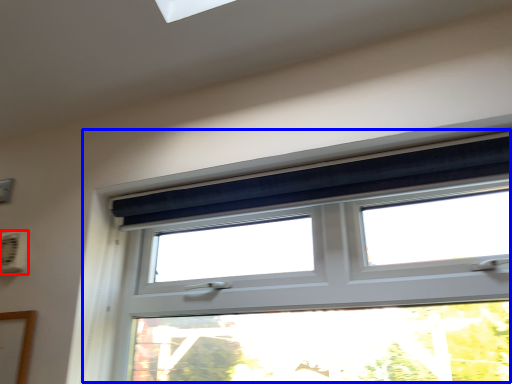
Question: Which point is closer to the camera, air conditioning (highlighted by a red box) or window (highlighted by a blue box)?

Choices:
 (A) air conditioning
 (B) window

Answer: (B)